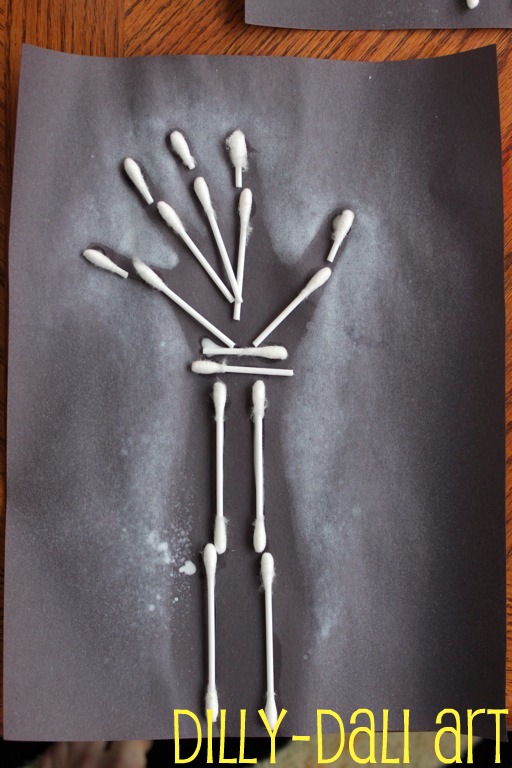
This screenshot has height=768, width=512. I want to click on cotton swabs (broken), so click(x=177, y=300), click(x=200, y=256), click(x=217, y=229), click(x=243, y=239), click(x=284, y=310), click(x=238, y=349), click(x=242, y=371).